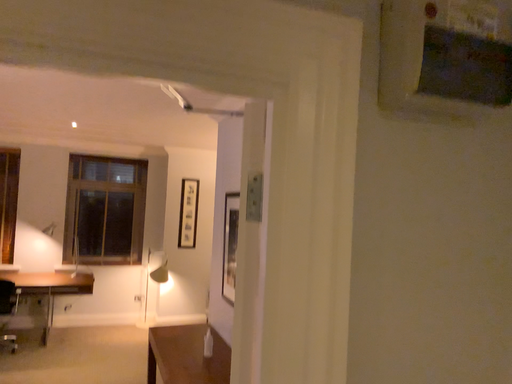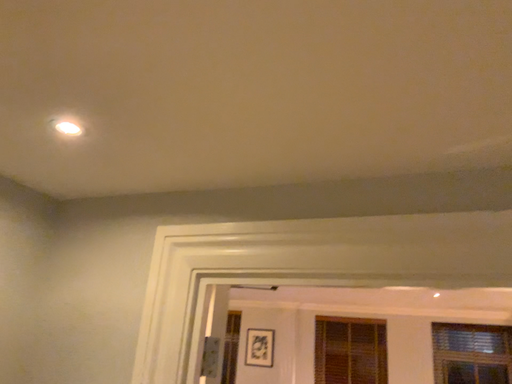
Question: How did the camera likely rotate when shooting the video?

Choices:
 (A) rotated left
 (B) rotated right

Answer: (A)